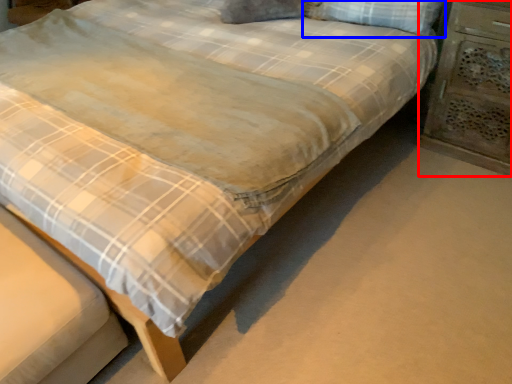
Question: Which object is closer to the camera taking this photo, nightstand (highlighted by a red box) or pillow (highlighted by a blue box)?

Choices:
 (A) nightstand
 (B) pillow

Answer: (A)